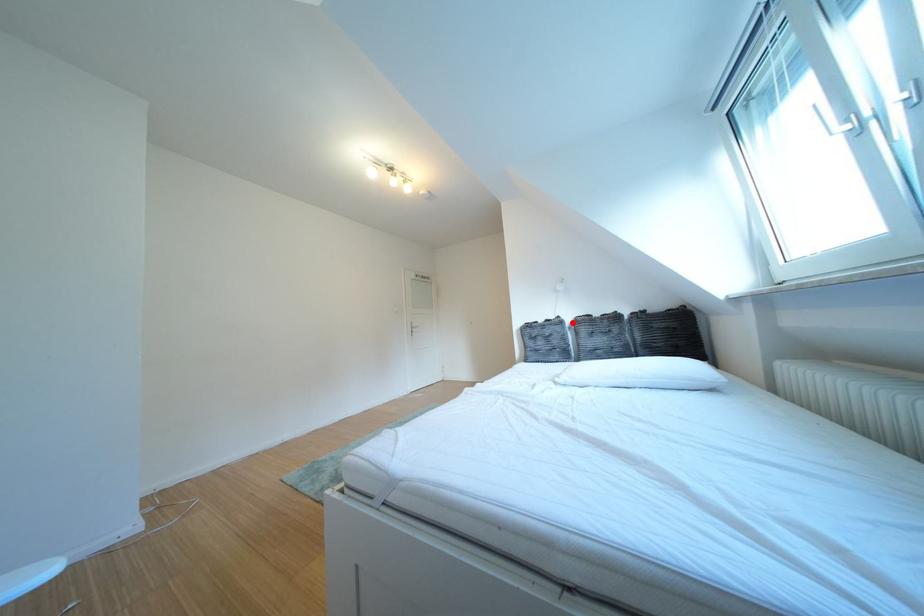
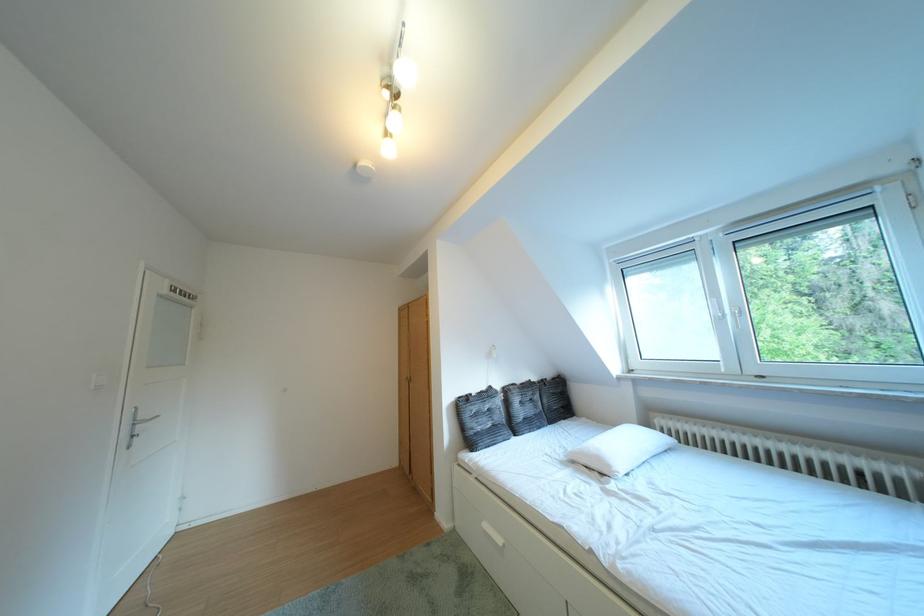
Question: I am providing you with two images of the same scene from different viewpoints. In image1, a red point is highlighted. Considering the same 3D point in image2, which of the following is correct?

Choices:
 (A) It is closer
 (B) It is farther

Answer: (B)